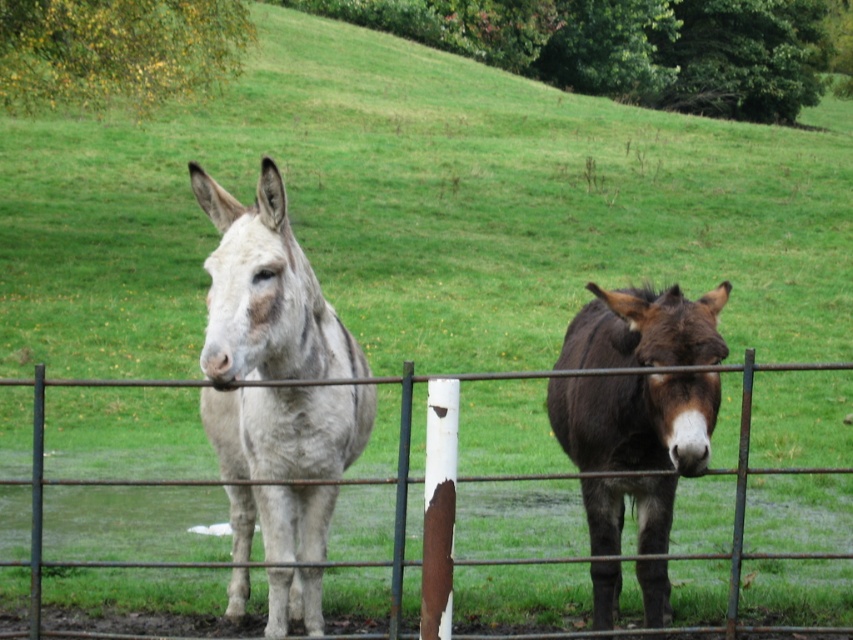
Question: Can you confirm if white speckled fur mule at center is positioned below rusty metal fence at center?

Choices:
 (A) no
 (B) yes

Answer: (B)

Question: Among these points, which one is nearest to the camera?

Choices:
 (A) (624, 452)
 (B) (233, 570)

Answer: (A)

Question: Is brown fuzzy mule at right closer to the viewer compared to rusty metal fence at center?

Choices:
 (A) yes
 (B) no

Answer: (A)

Question: Among these points, which one is farthest from the camera?

Choices:
 (A) (263, 330)
 (B) (630, 339)

Answer: (B)

Question: Does brown fuzzy mule at right appear on the left side of rusty metal fence at center?

Choices:
 (A) no
 (B) yes

Answer: (A)

Question: Which of the following is the closest to the observer?

Choices:
 (A) (592, 531)
 (B) (357, 426)

Answer: (B)